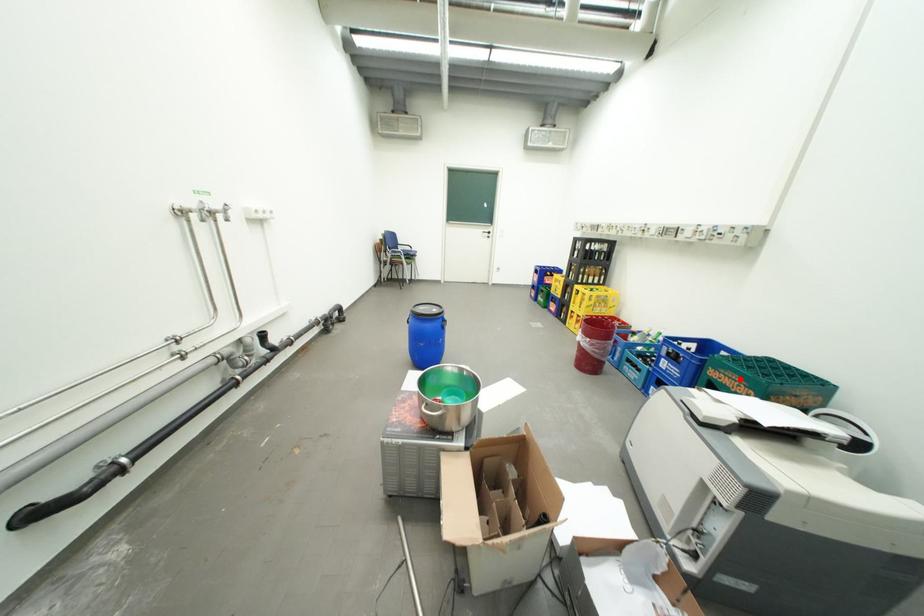
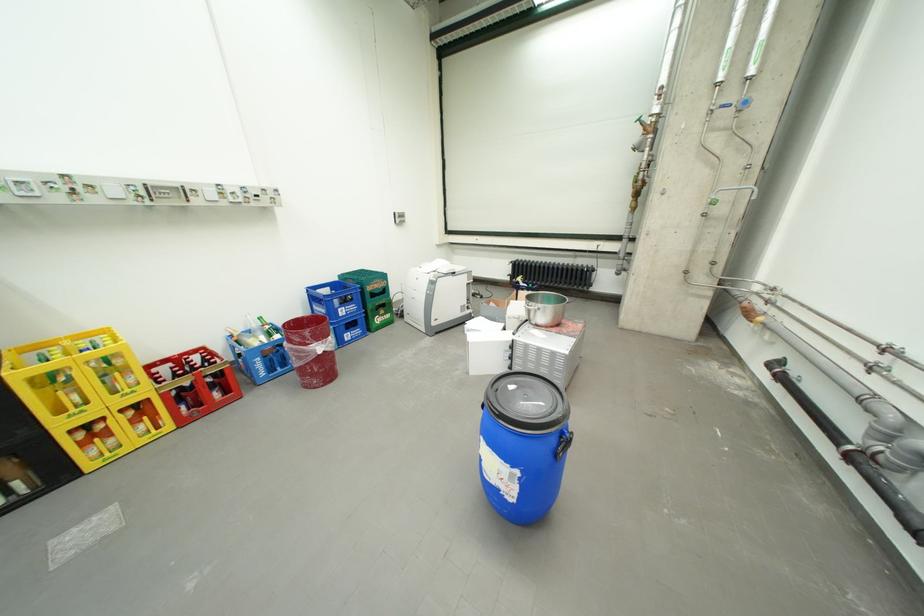
Question: I am providing you with two images of the same scene from different viewpoints. In image1, a red point is highlighted. Considering the same 3D point in image2, which of the following is correct?

Choices:
 (A) It is closer
 (B) It is farther

Answer: (A)